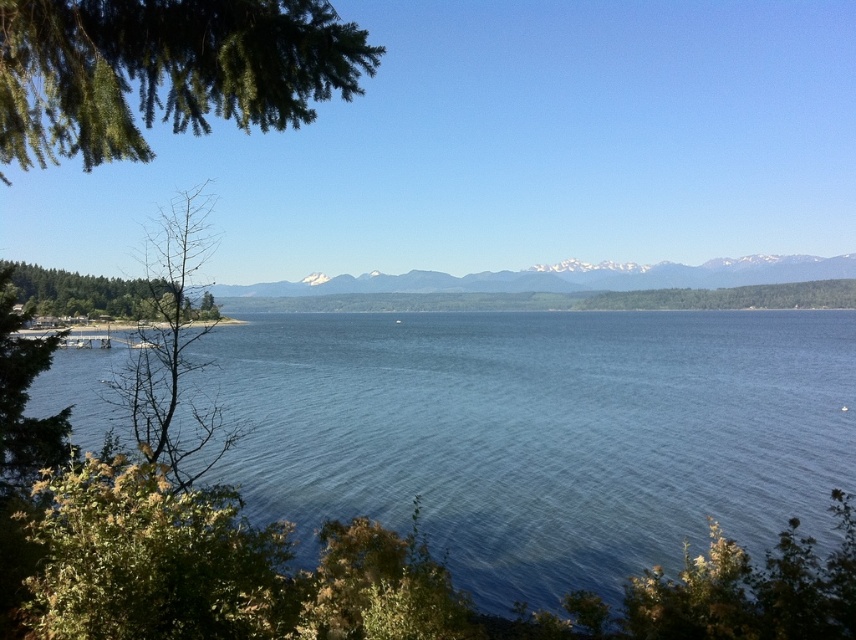
Question: Does green leafy tree at lower left appear over green matte tree at left?

Choices:
 (A) yes
 (B) no

Answer: (B)

Question: Can you confirm if green leafy tree at lower left is positioned to the left of green matte tree at left?

Choices:
 (A) no
 (B) yes

Answer: (A)

Question: Which point is closer to the camera taking this photo?

Choices:
 (A) click(x=104, y=301)
 (B) click(x=373, y=70)

Answer: (B)

Question: Which is nearer to the green matte tree at left?

Choices:
 (A) blue water at center
 (B) green needle-like leaves at upper left

Answer: (A)

Question: Which point is closer to the camera taking this photo?

Choices:
 (A) (776, 384)
 (B) (15, 440)

Answer: (B)

Question: Can you confirm if blue water at center is positioned above green leafy tree at lower left?

Choices:
 (A) yes
 (B) no

Answer: (A)